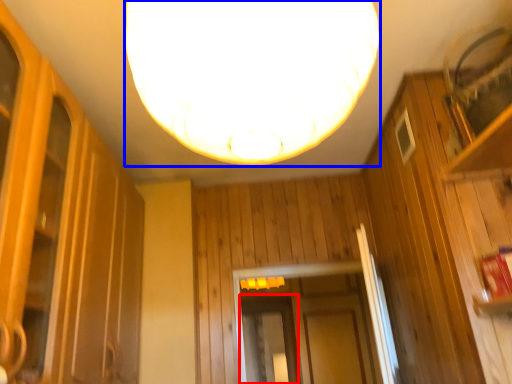
Question: Which object is further to the camera taking this photo, screen door (highlighted by a red box) or lamp (highlighted by a blue box)?

Choices:
 (A) screen door
 (B) lamp

Answer: (A)